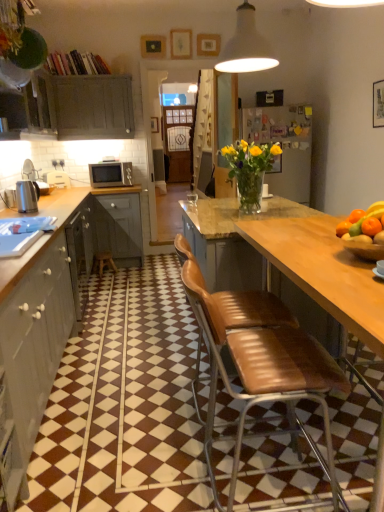
Question: Is matte gray cabinets at left, the third cabinetry in the back-to-front sequence, turned away from wooden picture frame at upper center?

Choices:
 (A) yes
 (B) no

Answer: (B)

Question: Is matte gray cabinets at left, the third cabinetry in the back-to-front sequence, bigger than wooden picture frame at upper center?

Choices:
 (A) no
 (B) yes

Answer: (B)

Question: Considering the relative sizes of matte gray cabinets at left, acting as the 3th cabinetry starting from the top, and wooden picture frame at upper center in the image provided, is matte gray cabinets at left, acting as the 3th cabinetry starting from the top, thinner than wooden picture frame at upper center?

Choices:
 (A) yes
 (B) no

Answer: (B)

Question: From the image's perspective, does matte gray cabinets at left, which is the 1th cabinetry from front to back, appear lower than wooden picture frame at upper center?

Choices:
 (A) yes
 (B) no

Answer: (A)

Question: Could you tell me if matte gray cabinets at left, which is the 1th cabinetry from front to back, is facing wooden picture frame at upper center?

Choices:
 (A) yes
 (B) no

Answer: (B)

Question: Visually, is brown leather chair at center, which appears as the second chair when viewed from the back, positioned to the left or to the right of matte gray cabinets at left, which is counted as the 1th cabinetry, starting from the bottom?

Choices:
 (A) right
 (B) left

Answer: (A)

Question: From their relative heights in the image, would you say brown leather chair at center, which appears as the second chair when viewed from the back, is taller or shorter than matte gray cabinets at left, acting as the 3th cabinetry starting from the top?

Choices:
 (A) short
 (B) tall

Answer: (B)

Question: Looking at the image, does brown leather chair at center, which appears as the second chair when viewed from the back, seem bigger or smaller compared to matte gray cabinets at left, acting as the 3th cabinetry starting from the top?

Choices:
 (A) small
 (B) big

Answer: (A)

Question: Do you think brown leather chair at center, positioned as the 1th chair in front-to-back order, is within matte gray cabinets at left, which is counted as the 1th cabinetry, starting from the bottom, or outside of it?

Choices:
 (A) outside
 (B) inside

Answer: (A)

Question: Would you say wooden picture frame at upper center is to the left or to the right of brown leather chair at center, acting as the 1th chair starting from the back, in the picture?

Choices:
 (A) right
 (B) left

Answer: (A)

Question: From the image's perspective, is wooden picture frame at upper center located above or below brown leather chair at center, which appears as the second chair when viewed from the front?

Choices:
 (A) above
 (B) below

Answer: (A)

Question: Is wooden picture frame at upper center wider or thinner than brown leather chair at center, which appears as the second chair when viewed from the front?

Choices:
 (A) thin
 (B) wide

Answer: (A)

Question: Is wooden picture frame at upper center taller or shorter than brown leather chair at center, which appears as the second chair when viewed from the front?

Choices:
 (A) short
 (B) tall

Answer: (A)

Question: Looking at the image, does brown leather bar stool at center seem bigger or smaller compared to matte gray cabinet at left, positioned as the 3th cabinetry in bottom-to-top order?

Choices:
 (A) big
 (B) small

Answer: (B)

Question: Is brown leather bar stool at center taller or shorter than matte gray cabinet at left, which ranks as the first cabinetry in back-to-front order?

Choices:
 (A) tall
 (B) short

Answer: (B)